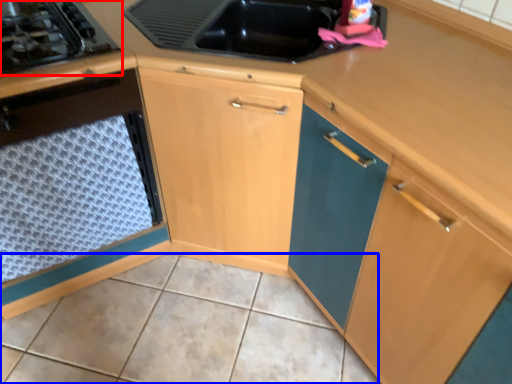
Question: Which point is closer to the camera, gas stove (highlighted by a red box) or tile (highlighted by a blue box)?

Choices:
 (A) gas stove
 (B) tile

Answer: (B)